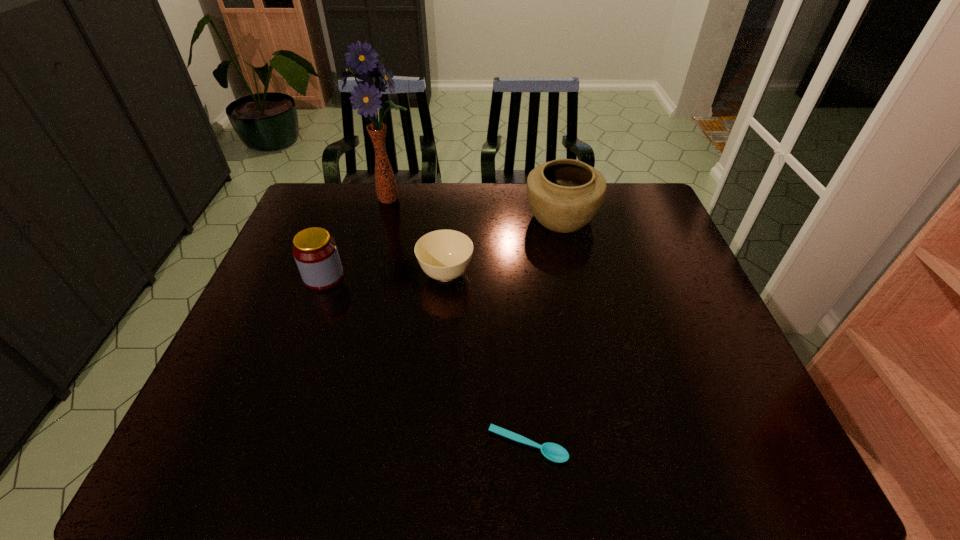
This screenshot has height=540, width=960. What are the coordinates of `vacant space positioned on the back of the third object from right to left` in the screenshot? It's located at (451, 211).

At what (x,y) coordinates should I click in order to perform the action: click on vacant area situated 0.240m on the left of the shortest object. Please return your answer as a coordinate pair (x, y). Looking at the image, I should click on (371, 446).

Locate an element on the screen. Image resolution: width=960 pixels, height=540 pixels. flower arrangement positioned at the far edge is located at coordinates (365, 97).

The height and width of the screenshot is (540, 960). Find the location of `pottery at the far edge`. pottery at the far edge is located at coordinates (564, 195).

This screenshot has height=540, width=960. I want to click on object at the near edge, so click(x=554, y=452).

Find the location of a particular element. The width and height of the screenshot is (960, 540). object that is positioned at the left edge is located at coordinates (315, 251).

The width and height of the screenshot is (960, 540). I want to click on free space at the far edge, so click(x=594, y=223).

The image size is (960, 540). What are the coordinates of `vacant space at the near edge` in the screenshot? It's located at pyautogui.click(x=510, y=443).

This screenshot has width=960, height=540. In the image, there is a desktop. What are the coordinates of `vacant space at the left edge` in the screenshot? It's located at (238, 432).

The image size is (960, 540). Find the location of `vacant space at the right edge of the desktop`. vacant space at the right edge of the desktop is located at coordinates (679, 371).